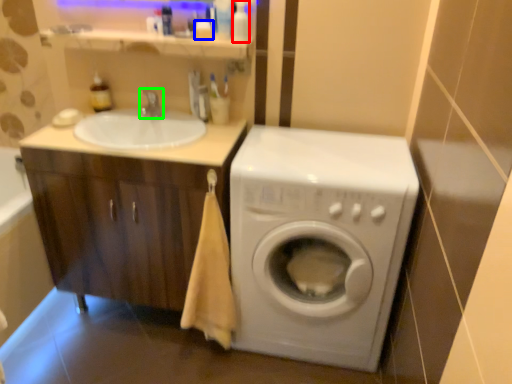
Question: Considering the real-world distances, which object is farthest from toiletry (highlighted by a red box)? toiletry (highlighted by a blue box) or tap (highlighted by a green box)?

Choices:
 (A) toiletry
 (B) tap

Answer: (B)